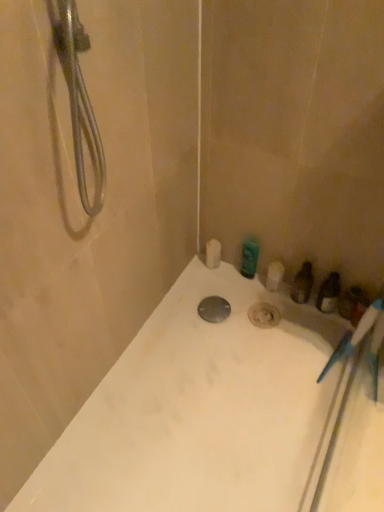
Question: From the image's perspective, would you say white matte toilet paper at upper center is positioned over metallic silver drain at center?

Choices:
 (A) yes
 (B) no

Answer: (A)

Question: From a real-world perspective, is white matte toilet paper at upper center located beneath metallic silver drain at center?

Choices:
 (A) yes
 (B) no

Answer: (B)

Question: Is white matte toilet paper at upper center wider than metallic silver drain at center?

Choices:
 (A) yes
 (B) no

Answer: (B)

Question: Can you confirm if white matte toilet paper at upper center is thinner than metallic silver drain at center?

Choices:
 (A) yes
 (B) no

Answer: (A)

Question: Is white matte toilet paper at upper center directly adjacent to metallic silver drain at center?

Choices:
 (A) no
 (B) yes

Answer: (A)

Question: Is white matte toilet paper at upper center bigger than metallic silver drain at center?

Choices:
 (A) no
 (B) yes

Answer: (B)

Question: Does white glossy bathtub at center have a smaller size compared to white matte toilet paper at upper center?

Choices:
 (A) no
 (B) yes

Answer: (A)

Question: From the image's perspective, is white glossy bathtub at center above white matte toilet paper at upper center?

Choices:
 (A) yes
 (B) no

Answer: (B)

Question: From a real-world perspective, is white glossy bathtub at center physically above white matte toilet paper at upper center?

Choices:
 (A) no
 (B) yes

Answer: (A)

Question: Would you consider white glossy bathtub at center to be distant from white matte toilet paper at upper center?

Choices:
 (A) no
 (B) yes

Answer: (A)

Question: Is white glossy bathtub at center at the left side of white matte toilet paper at upper center?

Choices:
 (A) yes
 (B) no

Answer: (B)

Question: Is white matte toilet paper at upper center completely or partially inside white glossy bathtub at center?

Choices:
 (A) no
 (B) yes

Answer: (A)

Question: Can you confirm if white glossy bathtub at center is smaller than green glossy bottle at upper right, which is counted as the 1th toiletry, starting from the left?

Choices:
 (A) yes
 (B) no

Answer: (B)